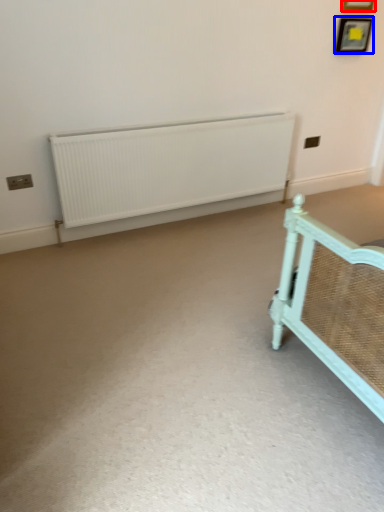
Question: Among these objects, which one is nearest to the camera, picture frame (highlighted by a red box) or picture frame (highlighted by a blue box)?

Choices:
 (A) picture frame
 (B) picture frame

Answer: (A)